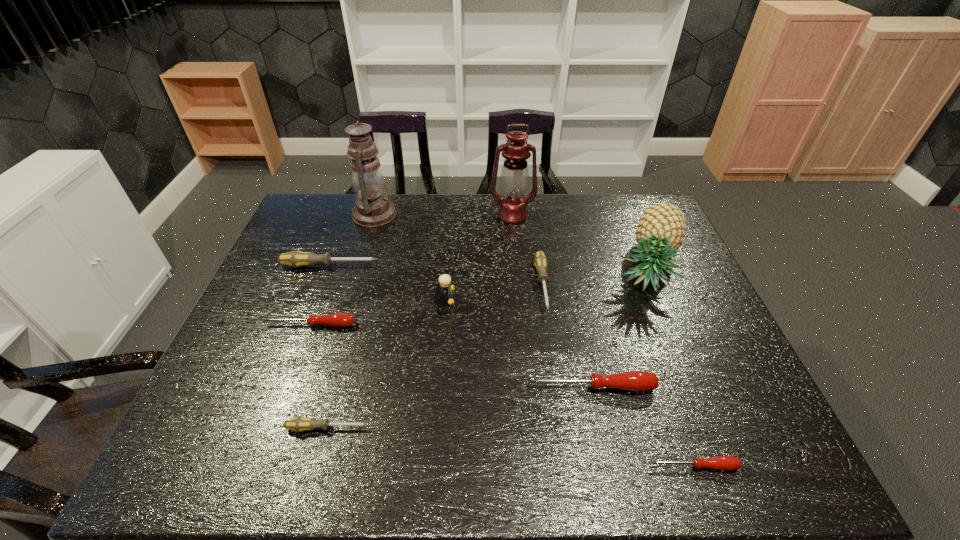
The image size is (960, 540). Find the location of `red oil lamp`. red oil lamp is located at coordinates (514, 178).

The height and width of the screenshot is (540, 960). Find the location of `the left oil lamp`. the left oil lamp is located at coordinates (373, 209).

Where is `pineapple`? The width and height of the screenshot is (960, 540). pineapple is located at coordinates (660, 231).

Find the location of `Lego`. Lego is located at coordinates (444, 280).

Locate an element on the screen. This screenshot has width=960, height=540. the seventh shortest object is located at coordinates (444, 280).

Where is `the biggest gray screwdriver`? This screenshot has height=540, width=960. the biggest gray screwdriver is located at coordinates (296, 259).

This screenshot has width=960, height=540. I want to click on the biggest red screwdriver, so click(x=633, y=380).

Image resolution: width=960 pixels, height=540 pixels. Find the location of `the third nearest screwdriver`. the third nearest screwdriver is located at coordinates (633, 380).

Find the location of a particular element. Image resolution: width=960 pixels, height=540 pixels. the rightmost gray screwdriver is located at coordinates (540, 261).

Locate an element on the screen. the leftmost red screwdriver is located at coordinates (337, 319).